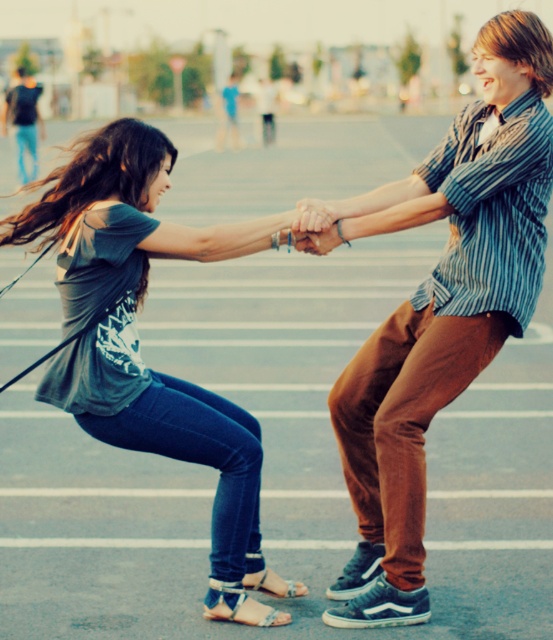
You are standing at the origin point of the image coordinate system. You want to locate the matte gray shirt at center. In which direction should you move to reach it?

The matte gray shirt at center is located at point 0.481 in the x direction and 0.794 in the y direction. Since the origin is at the bottom left corner, you should move to the right 48.1 percent of the image width and up 79.4 percent of the image height to reach the matte gray shirt at center.

You are a photographer trying to capture a closeup of both the blue fabric sandal at lower center and the dark blue jeans at upper left in the scene. Given their distance apart, will you need to use a zoom lens to ensure both are in focus and clearly visible?

The blue fabric sandal at lower center is 20.59 meters away from the dark blue jeans at upper left. Since they are far apart, using a zoom lens would help bring both into clear focus and visibility.

In the scene shown: You are a photographer standing at the edge of the scene. You want to take a photo of the matte gray shirt at center and the white leather sandal at lower center. Can you fit both objects in the frame if your camera has a maximum horizontal field of view of 37 inches?

The matte gray shirt at center and white leather sandal at lower center are 37.62 inches apart. Since the distance between them exceeds the camera lens field of view of 37 inches, the photographer cannot fit both objects in the frame.